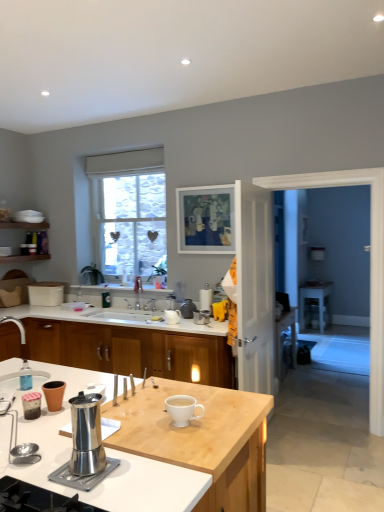
Question: Is point (208, 333) closer or farther from the camera than point (238, 327)?

Choices:
 (A) farther
 (B) closer

Answer: (A)

Question: Considering the positions of white glossy countertop at center, the 2th countertop positioned from the front, and white glossy door at center, positioned as the first screen door in left-to-right order, in the image, is white glossy countertop at center, the 2th countertop positioned from the front, wider or thinner than white glossy door at center, positioned as the first screen door in left-to-right order,?

Choices:
 (A) wide
 (B) thin

Answer: (A)

Question: Which of these objects is positioned farthest from the white paper towel holder at center, which ranks as the second appliance in front-to-back order?

Choices:
 (A) matte white desk at right
 (B) clear glass window at upper left
 (C) white ceramic sink at center
 (D) white glossy screen door at right, which is counted as the first screen door, starting from the right
 (E) white glossy mug at center, positioned as the 1th coffee cup in right-to-left order

Answer: (A)

Question: Which object is the closest to the clear glass window at upper left?

Choices:
 (A) white glossy countertop at center, which is counted as the first countertop, starting from the back
 (B) white paper towel holder at center, arranged as the second appliance when viewed from the left
 (C) white ceramic sink at center
 (D) wooden cabinet at center
 (E) light wood countertop at center, placed as the 1th countertop when sorted from front to back

Answer: (C)